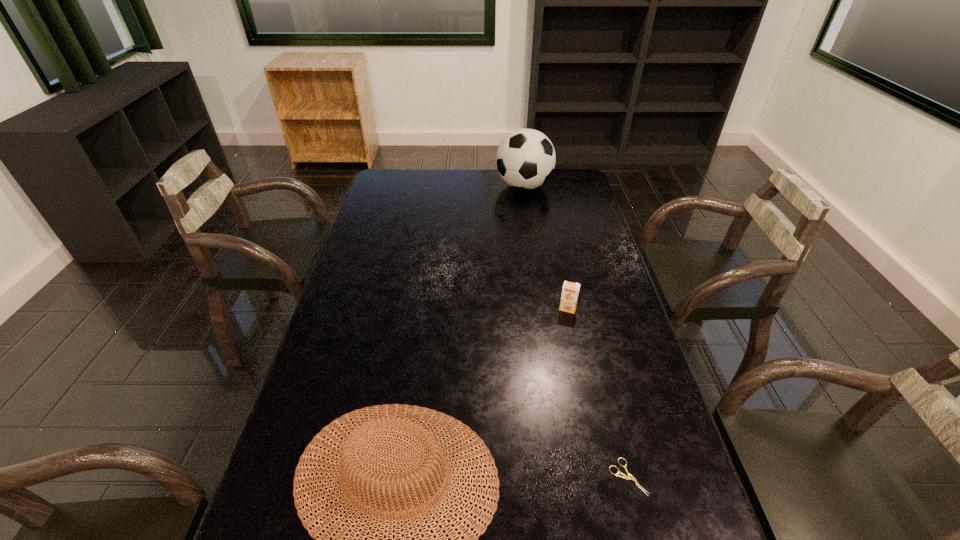
Where is `free space between the shears and the tallest object`? The image size is (960, 540). free space between the shears and the tallest object is located at coordinates (576, 332).

Locate an element on the screen. The image size is (960, 540). vacant area that lies between the soccer ball and the shears is located at coordinates coord(576,332).

Image resolution: width=960 pixels, height=540 pixels. What are the coordinates of `free area in between the soccer ball and the orange juice` in the screenshot? It's located at (545, 247).

Locate an element on the screen. object that stands as the second closest to the second farthest object is located at coordinates (624, 476).

Identify which object is located as the second nearest to the shortest object. Please provide its 2D coordinates. Your answer should be formatted as a tuple, i.e. [(x, y)], where the tuple contains the x and y coordinates of a point satisfying the conditions above.

[(570, 290)]

At what (x,y) coordinates should I click in order to perform the action: click on vacant space that satisfies the following two spatial constraints: 1. on the front side of the soccer ball; 2. on the left side of the third tallest object. Please return your answer as a coordinate pair (x, y). This screenshot has width=960, height=540. Looking at the image, I should click on (541, 308).

You are a GUI agent. You are given a task and a screenshot of the screen. Output one action in this format:
    pyautogui.click(x=<x>, y=<y>)
    Task: Click on the vacant space that satisfies the following two spatial constraints: 1. on the front side of the second farthest object; 2. on the right side of the shears
    The height and width of the screenshot is (540, 960).
    Given the screenshot: What is the action you would take?
    pyautogui.click(x=603, y=477)